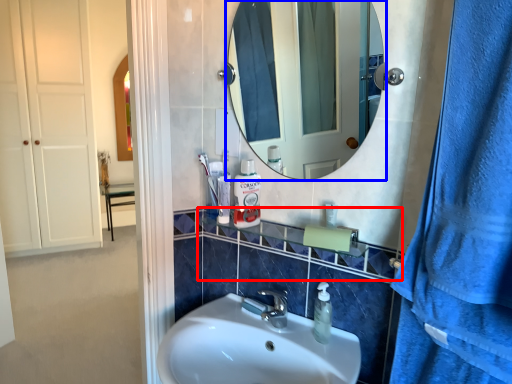
Question: Among these objects, which one is nearest to the camera, balustrade (highlighted by a red box) or mirror (highlighted by a blue box)?

Choices:
 (A) balustrade
 (B) mirror

Answer: (B)